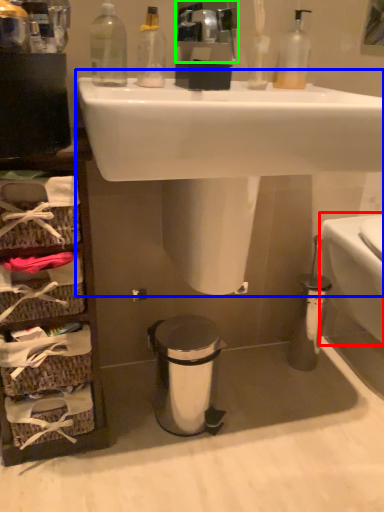
Question: Which object is positioned closest to toilet bowl (highlighted by a red box)? Select from sink (highlighted by a blue box) and mirror (highlighted by a green box).

Choices:
 (A) sink
 (B) mirror

Answer: (A)